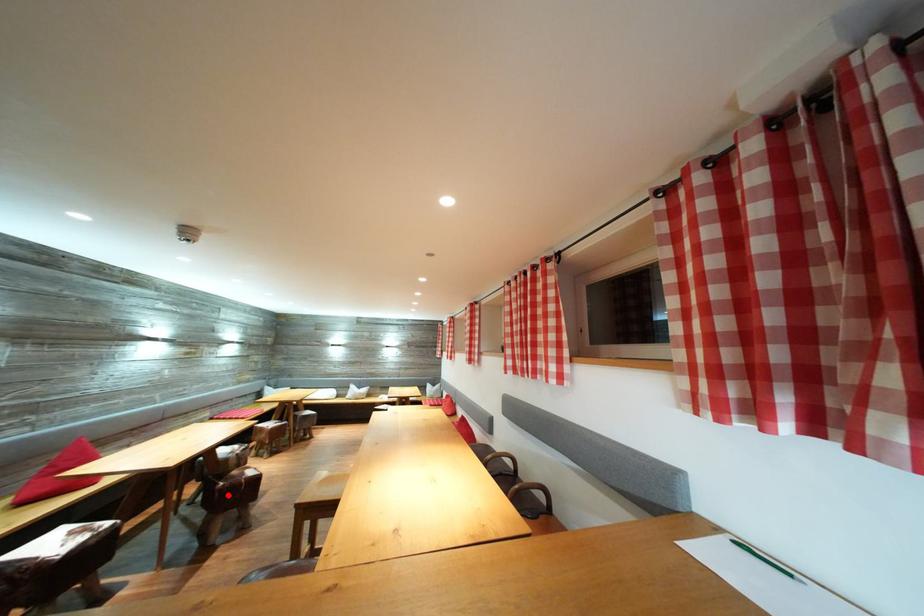
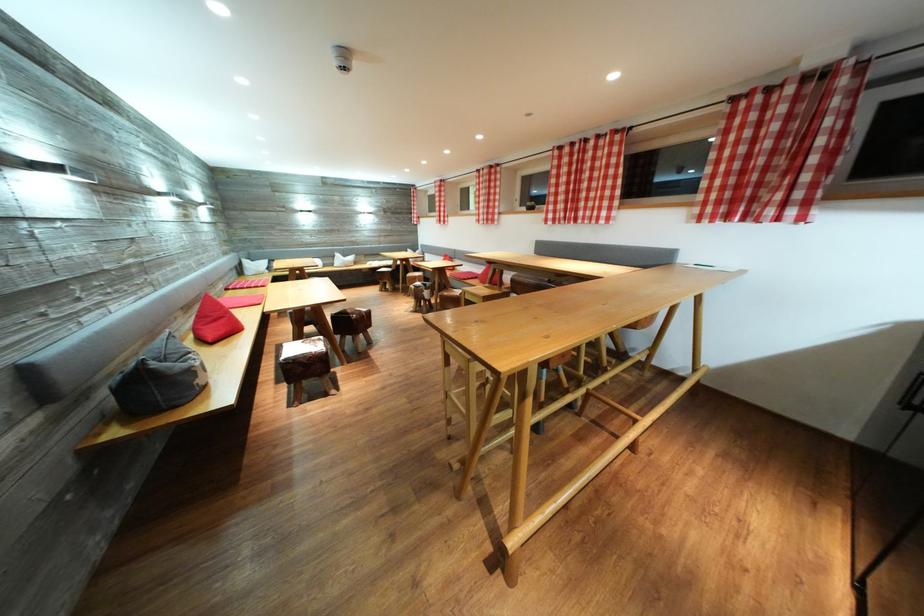
Question: I am providing you with two images of the same scene from different viewpoints. Given a red point in image1, look at the same physical point in image2. Is it:

Choices:
 (A) Closer to the viewpoint
 (B) Farther from the viewpoint

Answer: (A)